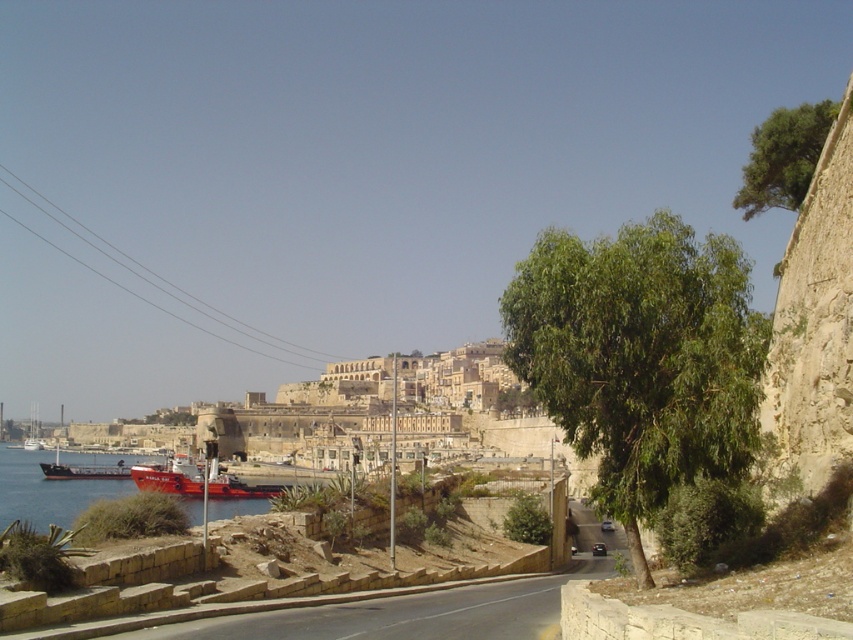
You are a hiker standing on the paved road and want to take a photo of the green leafy tree at center. Which direction should you face to ensure the green leafy tree at upper right does not block your view?

You should face away from the green leafy tree at upper right so that the green leafy tree at center is positioned under it, allowing you to capture the green leafy tree at center without obstruction.

You are a photographer planning to take a landscape photo of the coastal scene. You want to ensure that both the green leafy tree at upper right and the red matte ship at lower left are clearly visible in your shot. Considering their sizes, which object should you focus on to ensure both are in frame?

The green leafy tree at upper right is bigger than the red matte ship at lower left, so focusing on the tree will help ensure both are in frame as it occupies more space in the composition.